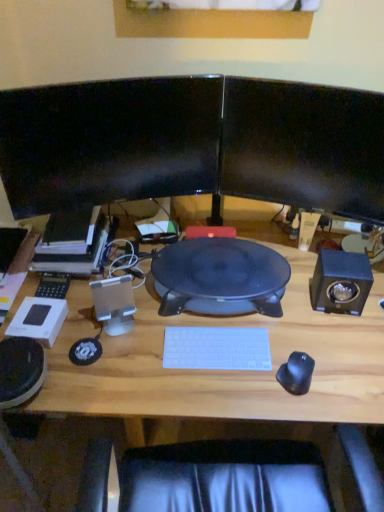
Identify the location of free point above wooden desk at center (from a real-world perspective). This screenshot has height=512, width=384. (242, 317).